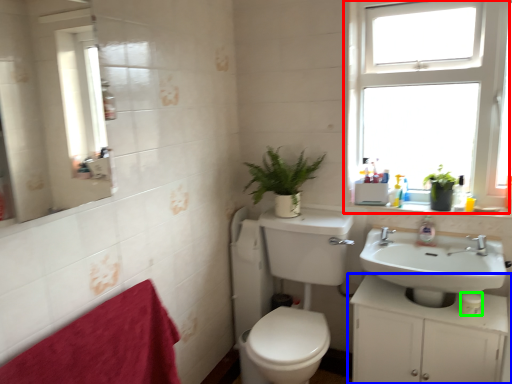
Question: Considering the real-world distances, which object is closest to window (highlighted by a red box)? bathroom cabinet (highlighted by a blue box) or toilet paper (highlighted by a green box).

Choices:
 (A) bathroom cabinet
 (B) toilet paper

Answer: (A)